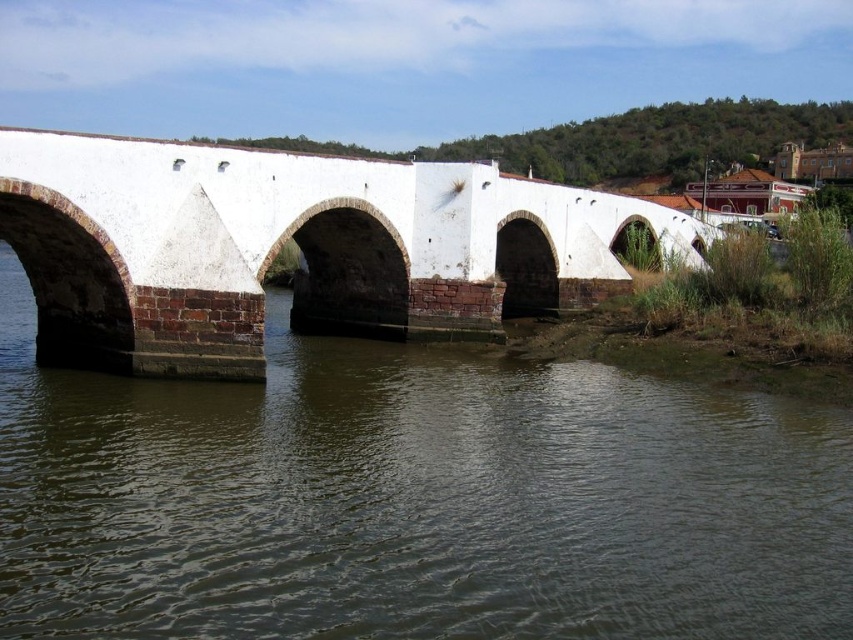
You are a tourist standing on the white brick bridge at center. Looking down, you see the brown stone river at center. Which object is located directly beneath you?

The brown stone river at center is directly beneath the white brick bridge at center, so the brown stone river at center is located directly beneath you.

You are standing on the historic stone bridge and want to walk towards the point that is closer to you. Which point should you head towards, point (601, 426) or point (473, 284)?

You should head towards point (601, 426) because it is closer to the viewer than point (473, 284).